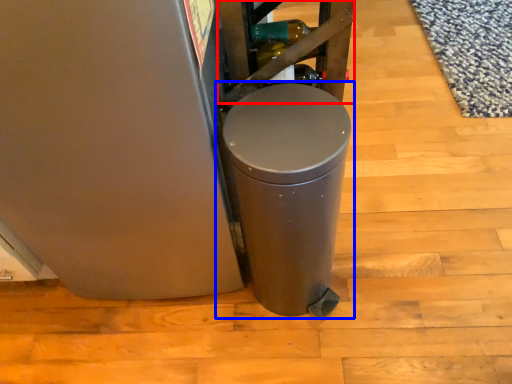
Question: Which object is further to the camera taking this photo, shelf (highlighted by a red box) or waste container (highlighted by a blue box)?

Choices:
 (A) shelf
 (B) waste container

Answer: (A)